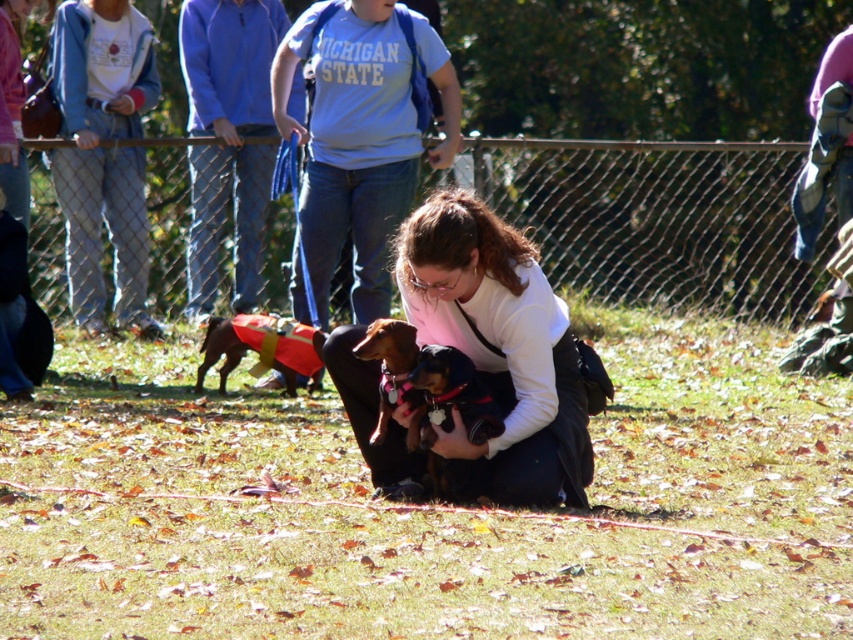
You are a dog trainer observing the two dogs in the image. The woman is holding the velvety black dog at center and the brown fur dog at center. Which dog do you think requires a smaller collar size?

The velvety black dog at center has a smaller size compared to the brown fur dog at center, so it requires a smaller collar size.